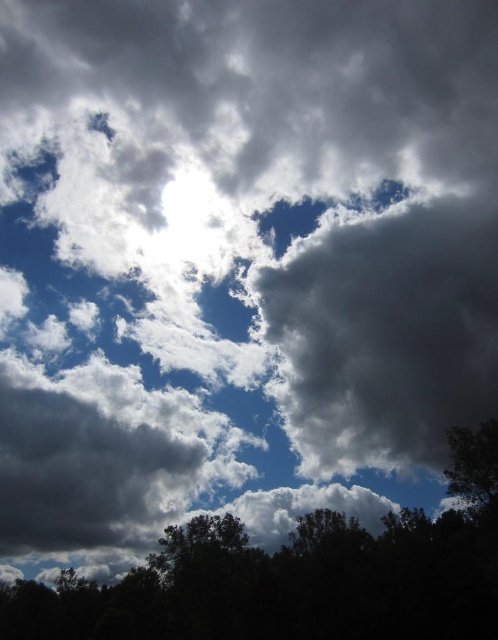
You are an airplane pilot flying at a high altitude and see the dark gray fluffy cloud at upper center and the dark green leafy tree at bottom. Which object is higher in the sky?

The dark gray fluffy cloud at upper center is higher in the sky than the dark green leafy tree at bottom because it is located above it.